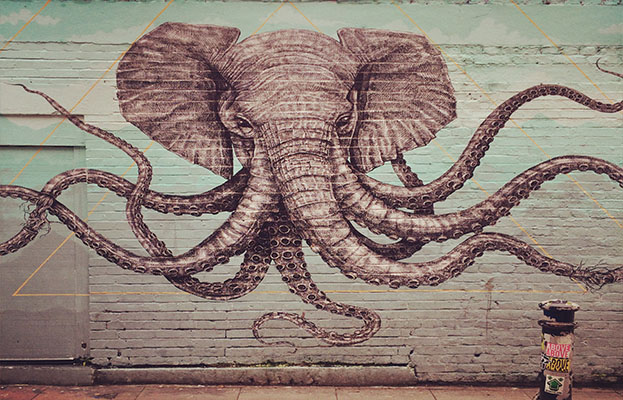
At what (x,y) coordinates should I click in order to perform the action: click on stickers. Please return your answer as a coordinate pair (x, y). The height and width of the screenshot is (400, 623). Looking at the image, I should click on (554, 380), (558, 356).